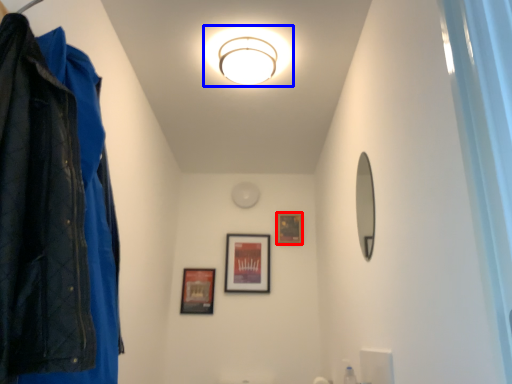
Question: Which of the following is the closest to the observer, picture frame (highlighted by a red box) or light fixture (highlighted by a blue box)?

Choices:
 (A) picture frame
 (B) light fixture

Answer: (B)